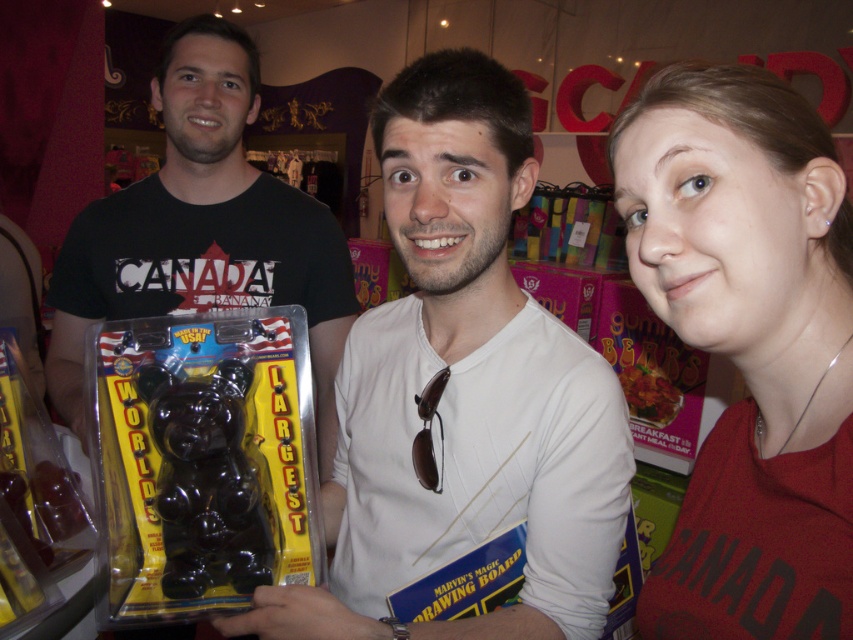
You are standing at point (283, 264) and want to walk to the exit located at point (448, 349). Is your path directly forward or do you need to move sideways?

The point (448, 349) is in front of point (283, 264), so your path to the exit is directly forward.

You are a store employee and need to place a new camera on the shelf near the matte red shirt at center. The camera requires at least 18 inches of space. Can you fit it there?

The matte red shirt at center and camera are 17.38 inches apart from each other, which is less than the required 18 inches. Therefore, the camera cannot be placed there as it does not meet the space requirement.

You are a customer in the store and want to pick up the glossy plastic bear at center. Which direction should you look relative to the matte black gummy bear at center?

The glossy plastic bear at center is located below the matte black gummy bear at center, so you should look downward from the matte black gummy bear at center to find the glossy plastic bear at center.